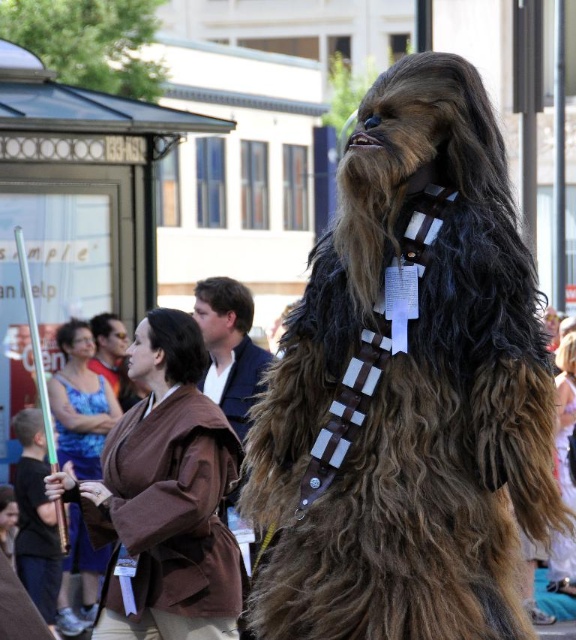
You are a costume designer examining the two brown fabric garments in the image. Which of the two, the brown fabric robe at center or the brown fabric shirt at center, is shorter in height?

The brown fabric robe at center is not as tall as the brown fabric shirt at center, so the robe is shorter in height.

You are a costume designer trying to figure out the layering of two brown fabric items in the image. Which item is placed below the other, the brown fabric robe at center or the brown fabric shirt at center?

The brown fabric robe at center is positioned under the brown fabric shirt at center, meaning the robe is the lower layer.